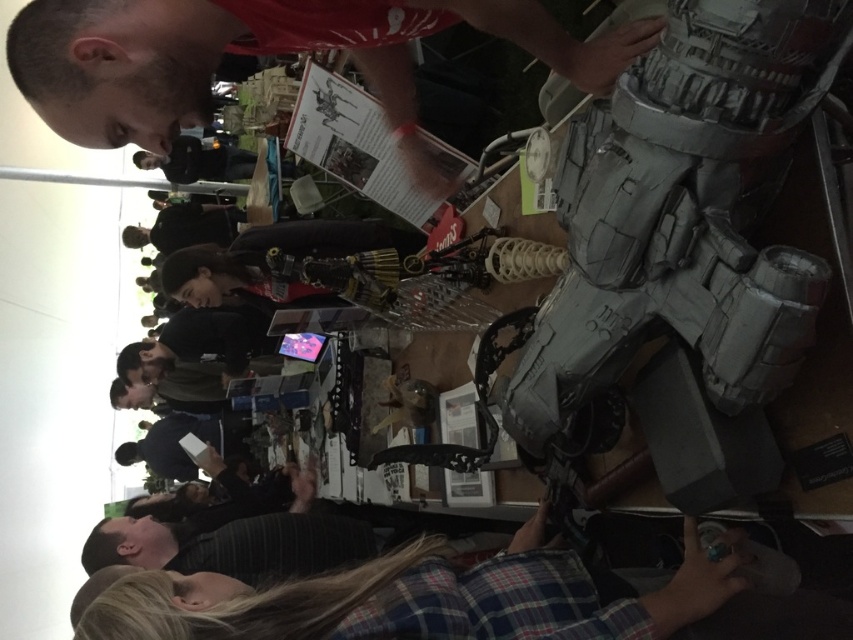
From the picture: Measure the distance between matte gray helmet at upper right and camera.

matte gray helmet at upper right and camera are 82.61 centimeters apart from each other.

What do you see at coordinates (264, 52) in the screenshot? Image resolution: width=853 pixels, height=640 pixels. I see `matte gray helmet at upper right` at bounding box center [264, 52].

Is point (405, 138) farther from camera compared to point (701, 612)?

Yes, it is.

Locate an element on the screen. Image resolution: width=853 pixels, height=640 pixels. matte gray helmet at upper right is located at coordinates (264, 52).